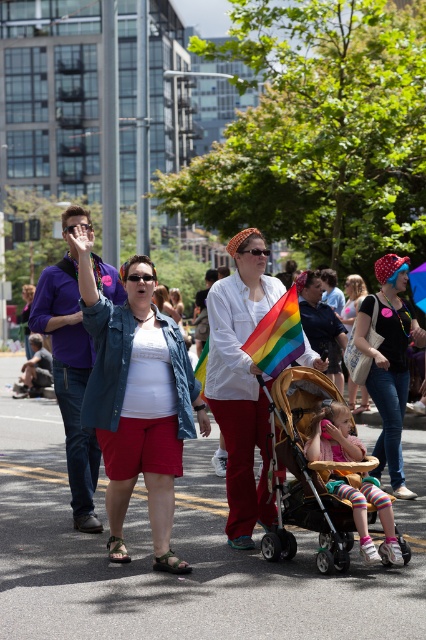
You are a photographer trying to capture both the denim jacket at center and the wooden baby carriage at center in a single shot. Which object should you focus on first to ensure both are in frame?

The denim jacket at center is positioned over the wooden baby carriage at center, so focusing on the denim jacket at center first will ensure both are captured in the frame.

You are a photographer trying to capture a candid shot of the denim jacket at center and the matte black shirt at center. Since you have a camera with a fixed focal length, you need to know which one is wider to ensure proper framing. Which object is wider?

The denim jacket at center is wider than the matte black shirt at center, so you should frame the denim jacket at center first to ensure it fits within the shot.